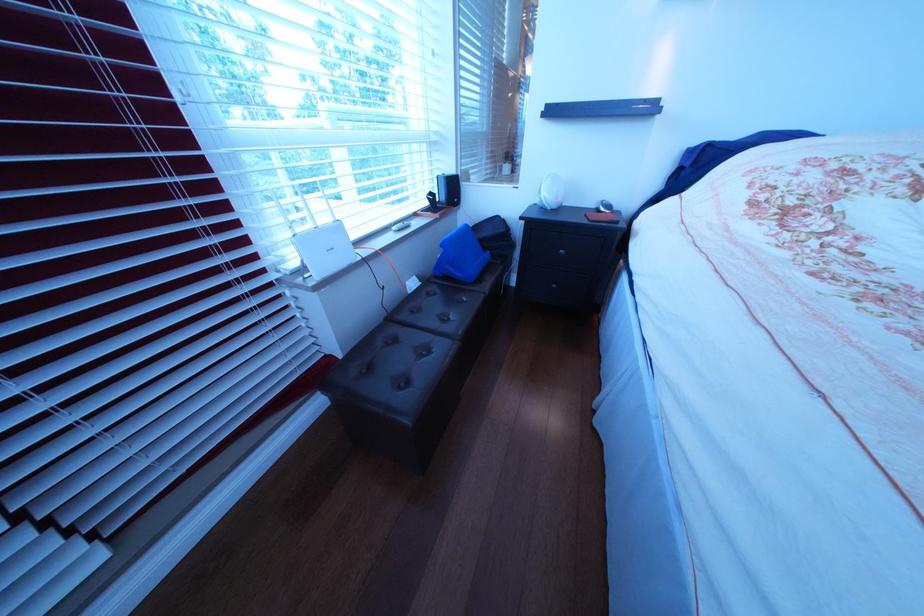
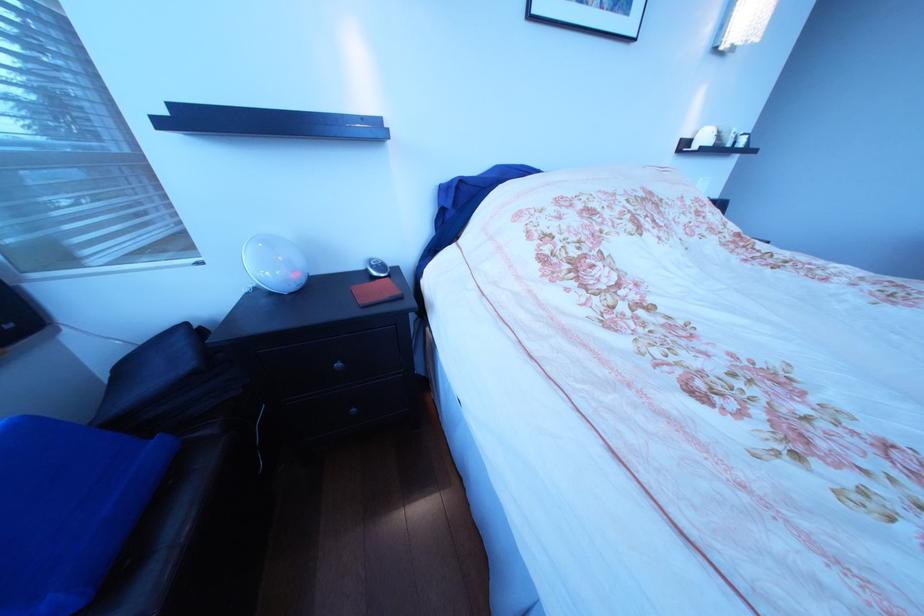
Locate, in the second image, the point that corresponds to (617,207) in the first image.

(387, 268)